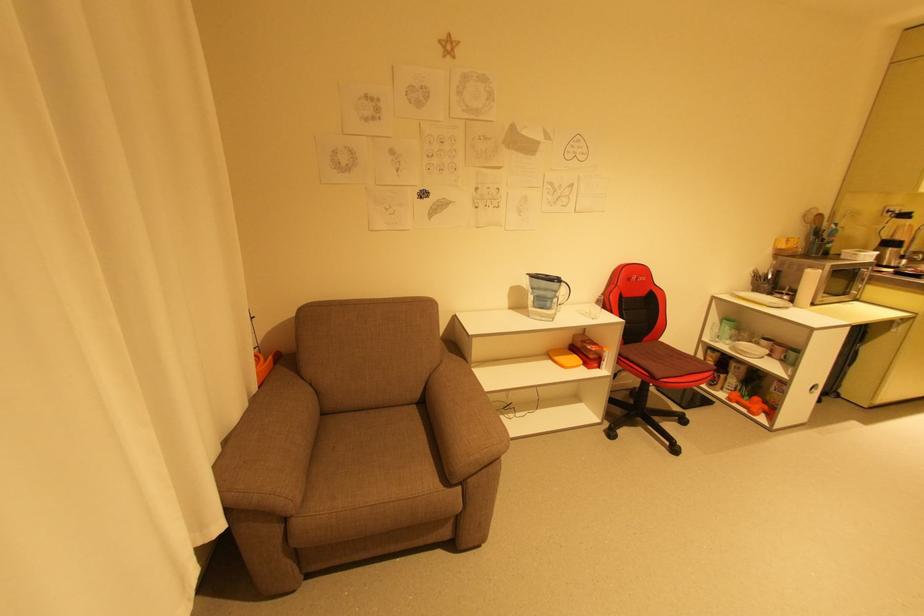
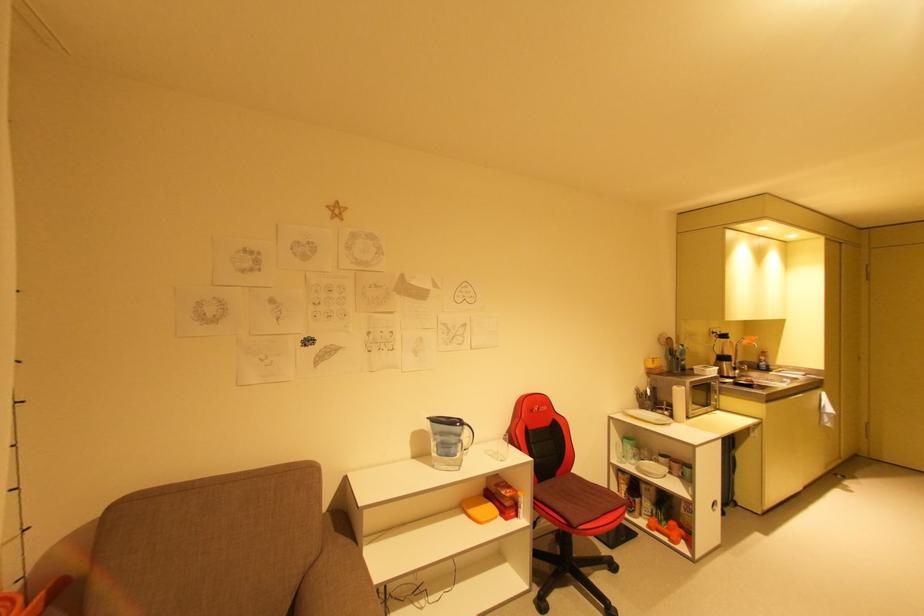
Find the pixel in the second image that matches (563,359) in the first image.

(477, 512)